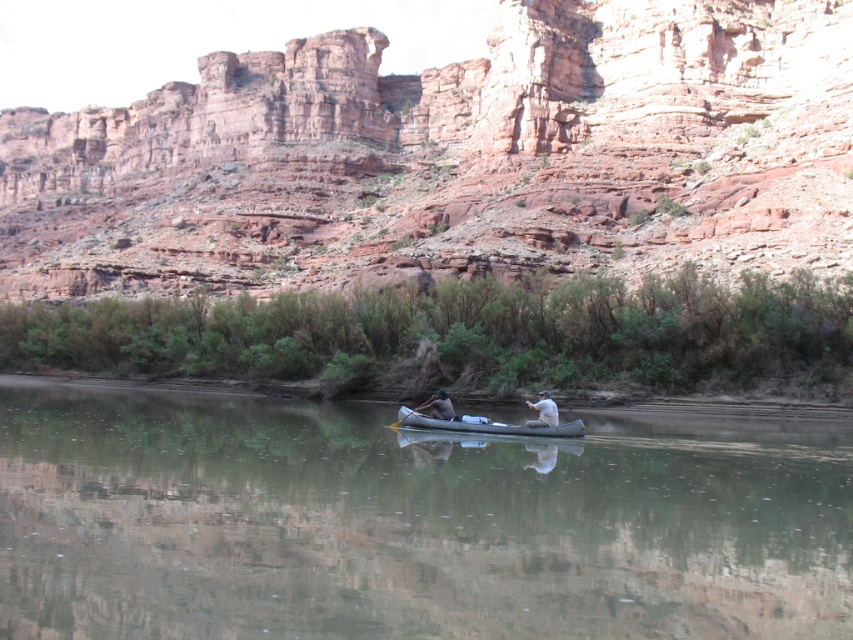
Question: Which point is closer to the camera taking this photo?

Choices:
 (A) (573, 432)
 (B) (113, 534)
 (C) (439, 401)

Answer: (B)

Question: Is white cotton shirt at center positioned behind wooden paddle at center?

Choices:
 (A) yes
 (B) no

Answer: (B)

Question: Is white cotton shirt at center smaller than wooden paddle at center?

Choices:
 (A) yes
 (B) no

Answer: (A)

Question: Can you confirm if reddish-brown rock cliff at upper center is smaller than gray rubber canoe at center?

Choices:
 (A) yes
 (B) no

Answer: (B)

Question: Based on their relative distances, which object is farther from the clear water at center?

Choices:
 (A) wooden paddle at center
 (B) reddish-brown rock cliff at upper center
 (C) white cotton shirt at center

Answer: (B)

Question: Which of the following is the farthest from the observer?

Choices:
 (A) gray rubber canoe at center
 (B) clear water at center

Answer: (A)